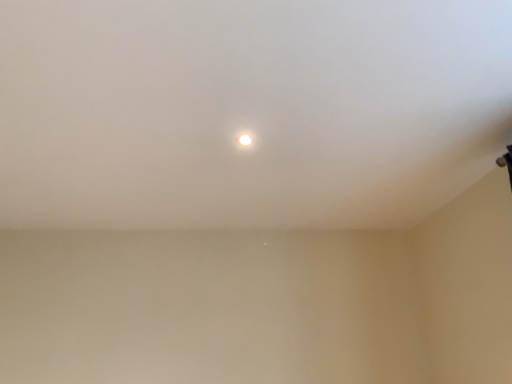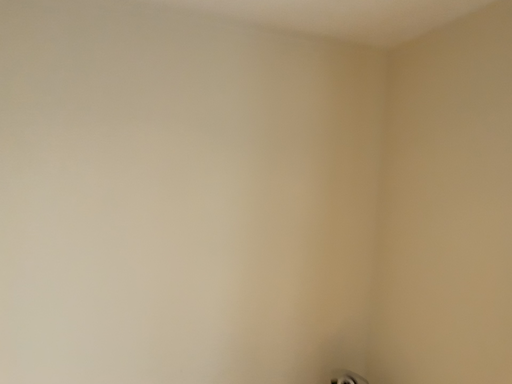
Question: Which way did the camera rotate in the video?

Choices:
 (A) rotated left
 (B) rotated right

Answer: (B)